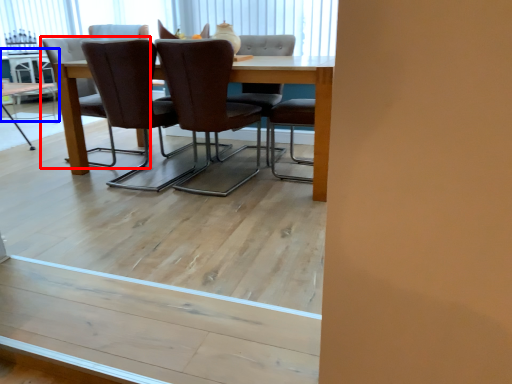
Question: Which of the following is the closest to the observer, chair (highlighted by a red box) or table (highlighted by a blue box)?

Choices:
 (A) chair
 (B) table

Answer: (A)